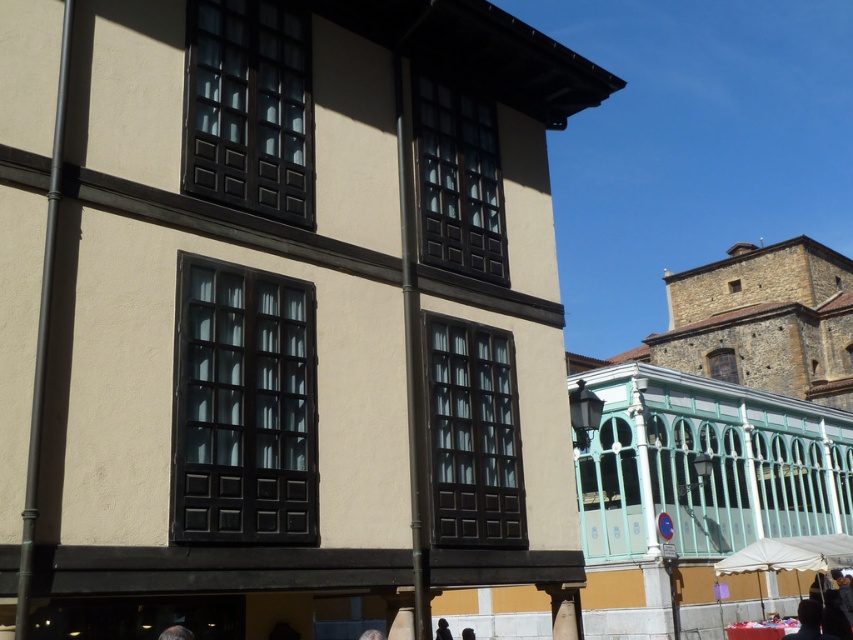
Question: Based on their relative distances, which object is farther from the dark blue fabric at lower right?

Choices:
 (A) gray hair at lower left
 (B) black hair at center
 (C) blue denim jeans at lower center
 (D) black fabric at center

Answer: (A)

Question: Which point is farther to the camera?

Choices:
 (A) black hair at center
 (B) blue denim jeans at lower center
 (C) dark blue fabric at lower right
 (D) black fabric at center

Answer: (D)

Question: Which point is closer to the camera taking this photo?

Choices:
 (A) (465, 628)
 (B) (166, 634)

Answer: (B)

Question: Is gray hair at lower left below blue denim jeans at lower center?

Choices:
 (A) no
 (B) yes

Answer: (A)

Question: Is gray hair at lower left below blue denim jeans at lower center?

Choices:
 (A) yes
 (B) no

Answer: (B)

Question: Considering the relative positions of black fabric at center and blue denim jeans at lower center in the image provided, where is black fabric at center located with respect to blue denim jeans at lower center?

Choices:
 (A) above
 (B) below

Answer: (B)